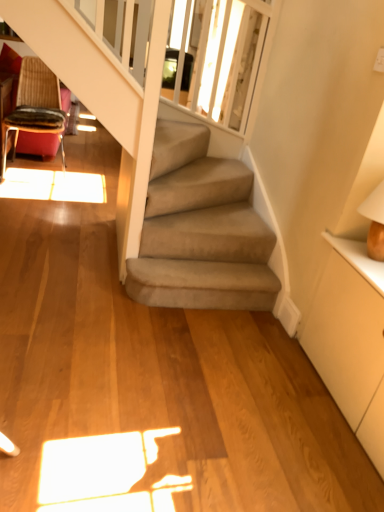
Where is `free location to the right of wooden textured chair at upper left`? This screenshot has height=512, width=384. free location to the right of wooden textured chair at upper left is located at coordinates (95, 180).